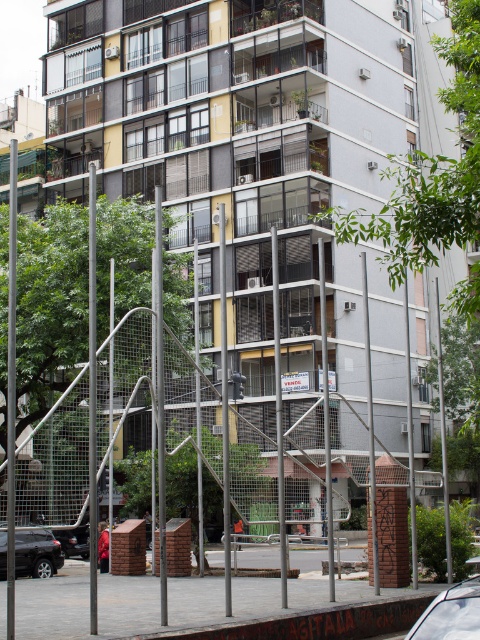
You are a delivery person approaching the building and see the metal mesh fence at center and the white glossy car at lower right. Which object is closer to the entrance of the building?

The metal mesh fence at center is closer to the entrance of the building than the white glossy car at lower right because it is positioned to the left of the car, which is further away.

You are a delivery driver who needs to park your vehicle between the white glossy car at lower right and the black matte car at lower left. Your delivery van is 2.5 meters wide. Can you fit your van between them?

The white glossy car at lower right has a lesser width compared to black matte car at lower left. The combined width of both cars is not provided, so it is impossible to determine if there is enough space for the van. Please check the actual distance between the cars.

You are standing at the entrance of the residential building and want to park your white glossy car at lower right. Based on the image, can you determine if the car is currently positioned in a parking spot or on the sidewalk?

The white glossy car at lower right is located at point 0.940, which is typically where parking spots are positioned, so it is likely parked in a parking spot.